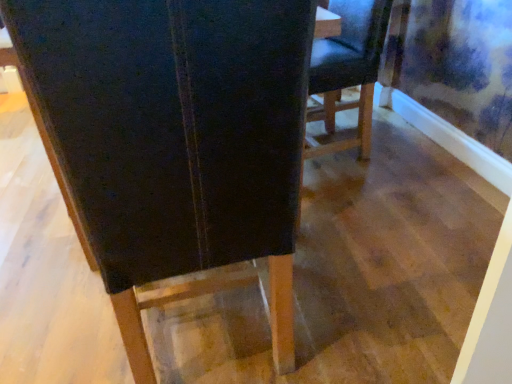
Locate an element on the screen. The image size is (512, 384). vacant area situated below matte black chair at center, which is counted as the 2th chair, starting from the left (from a real-world perspective) is located at coordinates click(x=334, y=140).